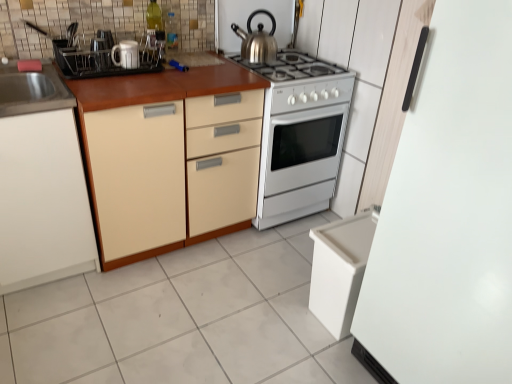
This screenshot has height=384, width=512. Identify the location of free space above white glossy tile at lower center (from a real-world perspective). (207, 293).